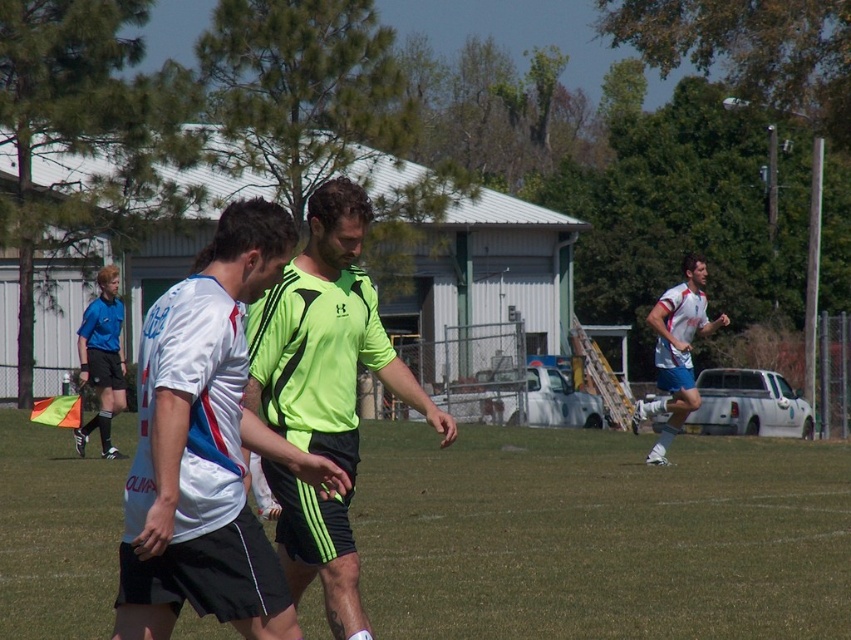
You are a soccer coach analyzing the field layout. Based on the image, which object is shorter between the green grass football field at center and the white matte soccer player at right?

The green grass football field at center is shorter than the white matte soccer player at right according to the description.

You are a soccer coach analyzing the game. You notice the green grass football field at center and the white matte jersey at center. Which object is taller?

The white matte jersey at center is taller than the green grass football field at center.

Based on the photo, you are a soccer coach observing the game. You notice the green grass football field at center and the white matte jersey at center. Which object is located below the other?

The green grass football field at center is positioned under the white matte jersey at center, meaning the white matte jersey at center is above it.